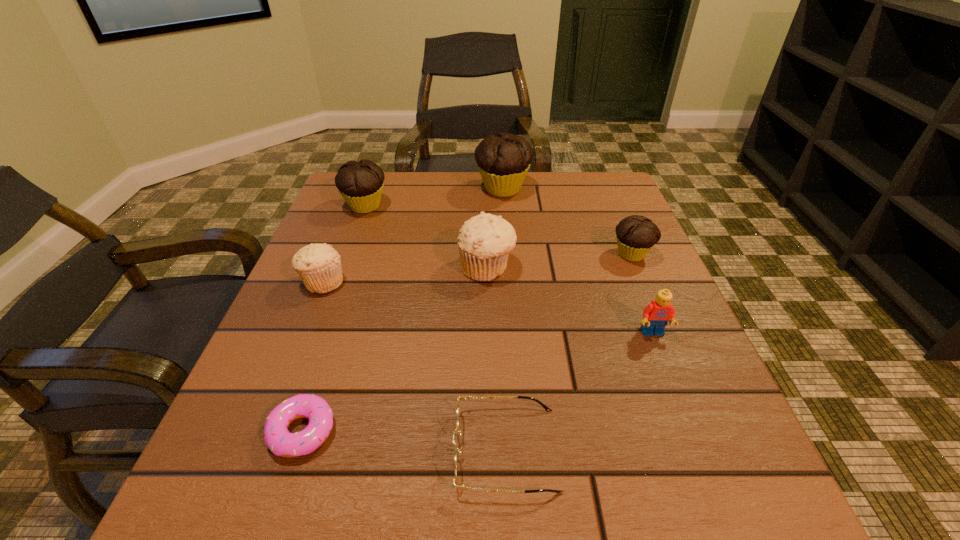
This screenshot has width=960, height=540. Find the location of `free point between the left beige muffin and the biggest chocolate muffin`. free point between the left beige muffin and the biggest chocolate muffin is located at coordinates (413, 235).

Where is `free space between the Lego and the smaller beige muffin`? free space between the Lego and the smaller beige muffin is located at coordinates (488, 307).

Locate an element on the screen. This screenshot has width=960, height=540. free space that is in between the Lego and the bigger beige muffin is located at coordinates (569, 300).

Choose which object is the second nearest neighbor to the second smallest chocolate muffin. Please provide its 2D coordinates. Your answer should be formatted as a tuple, i.e. [(x, y)], where the tuple contains the x and y coordinates of a point satisfying the conditions above.

[(503, 160)]

Where is `object that is the fourth closest to the left beige muffin`? The image size is (960, 540). object that is the fourth closest to the left beige muffin is located at coordinates click(x=465, y=398).

Identify which muffin is the fourth nearest to the tallest muffin. Please provide its 2D coordinates. Your answer should be formatted as a tuple, i.e. [(x, y)], where the tuple contains the x and y coordinates of a point satisfying the conditions above.

[(319, 266)]

Where is `muffin that can be found as the second closest to the tallest muffin`? muffin that can be found as the second closest to the tallest muffin is located at coordinates (360, 183).

Locate an element on the screen. chocolate muffin object that ranks as the third closest to the right beige muffin is located at coordinates (360, 183).

Locate an element on the screen. The width and height of the screenshot is (960, 540). chocolate muffin that stands as the closest to the tallest muffin is located at coordinates (360, 183).

What are the coordinates of `free spot that satisfies the following two spatial constraints: 1. on the back side of the bigger beige muffin; 2. on the left side of the left beige muffin` in the screenshot? It's located at (328, 267).